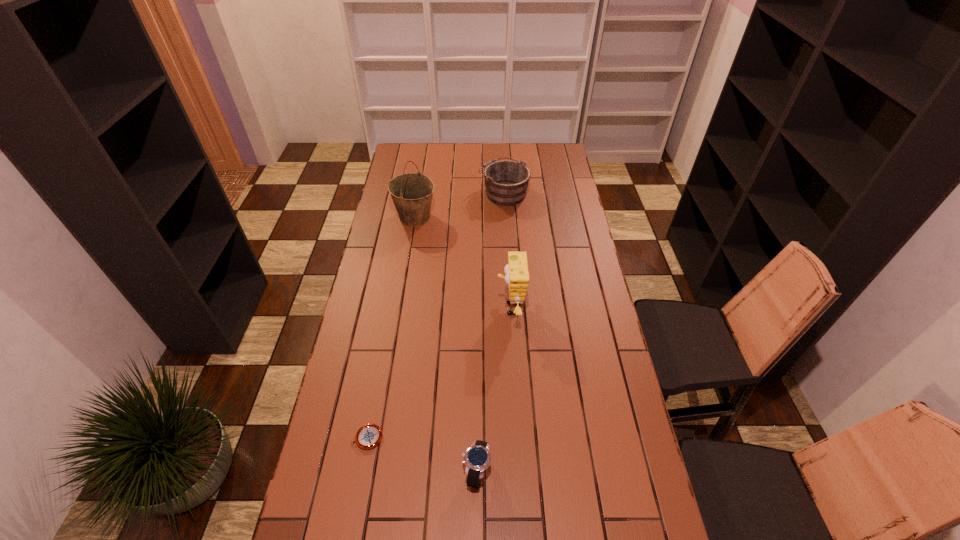
The image size is (960, 540). I want to click on free space that is in between the compass and the second shortest object, so (422, 454).

Identify the location of free space between the watch and the shortest object. (422, 454).

You are a GUI agent. You are given a task and a screenshot of the screen. Output one action in this format:
    pyautogui.click(x=<x>, y=<y>)
    Task: Click on the object that is the third nearest to the tallest object
    The height and width of the screenshot is (540, 960).
    Given the screenshot: What is the action you would take?
    pyautogui.click(x=368, y=436)

Locate an element on the screen. This screenshot has width=960, height=540. the closest object to the shorter wine bucket is located at coordinates (412, 193).